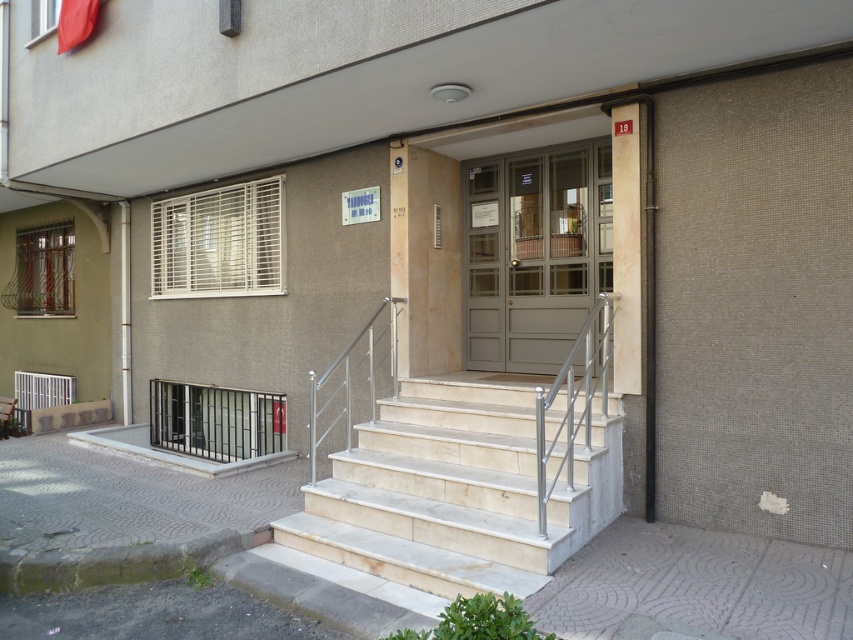
Is point (563, 476) farther from camera compared to point (370, 346)?

No, (563, 476) is in front of (370, 346).

You are a GUI agent. You are given a task and a screenshot of the screen. Output one action in this format:
    pyautogui.click(x=<x>, y=<y>)
    Task: Click on the white marble stairs at center
    Image resolution: width=853 pixels, height=640 pixels.
    Given the screenshot: What is the action you would take?
    pyautogui.click(x=450, y=497)

Describe the element at coordinates (450, 497) in the screenshot. I see `white marble stairs at center` at that location.

The height and width of the screenshot is (640, 853). Find the location of `white marble stairs at center`. white marble stairs at center is located at coordinates (450, 497).

Does white marble stairs at center have a greater width compared to matte gray door at center?

Correct, the width of white marble stairs at center exceeds that of matte gray door at center.

Does white marble stairs at center appear under matte gray door at center?

Indeed, white marble stairs at center is positioned under matte gray door at center.

Which is in front, point (431, 556) or point (480, 362)?

Point (431, 556)

Where is `white marble stairs at center`? white marble stairs at center is located at coordinates click(x=450, y=497).

This screenshot has width=853, height=640. What do you see at coordinates (534, 253) in the screenshot?
I see `matte gray door at center` at bounding box center [534, 253].

Can you confirm if matte gray door at center is taller than polished stainless steel handrail at center?

Yes, matte gray door at center is taller than polished stainless steel handrail at center.

The image size is (853, 640). I want to click on matte gray door at center, so click(534, 253).